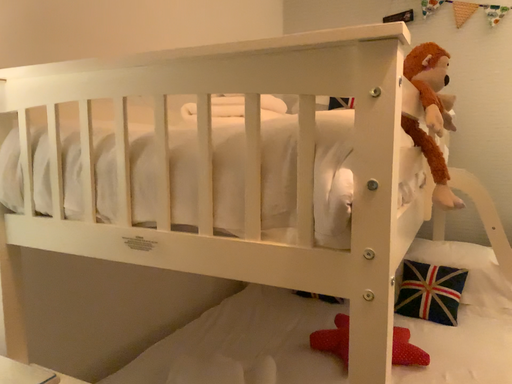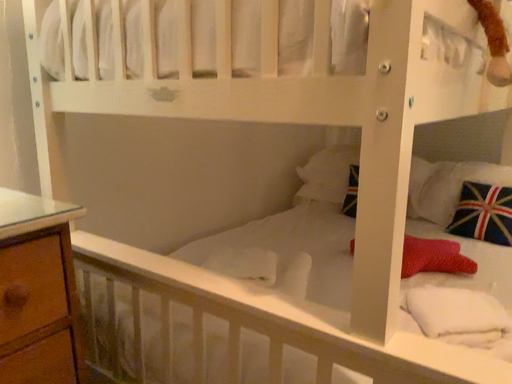
Question: Which way did the camera rotate in the video?

Choices:
 (A) rotated left
 (B) rotated right

Answer: (A)